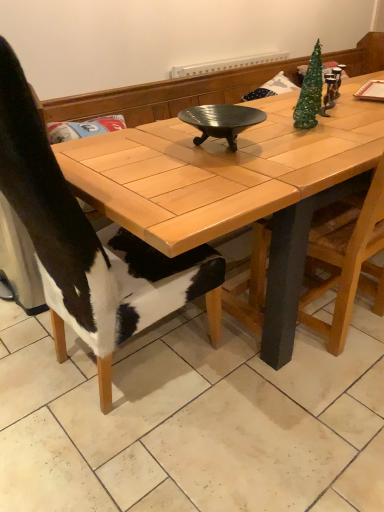
Question: From the image's perspective, does cowhide at left, which ranks as the first chair in left-to-right order, appear higher than wooden table at center?

Choices:
 (A) yes
 (B) no

Answer: (B)

Question: Is cowhide at left, marked as the 2th chair in a right-to-left arrangement, aimed at wooden table at center?

Choices:
 (A) no
 (B) yes

Answer: (B)

Question: Does cowhide at left, which ranks as the first chair in left-to-right order, have a greater height compared to wooden table at center?

Choices:
 (A) yes
 (B) no

Answer: (A)

Question: From a real-world perspective, does cowhide at left, which ranks as the first chair in left-to-right order, stand above wooden table at center?

Choices:
 (A) yes
 (B) no

Answer: (A)

Question: Is wooden table at center at the back of cowhide at left, marked as the 2th chair in a right-to-left arrangement?

Choices:
 (A) no
 (B) yes

Answer: (B)

Question: Can you confirm if cowhide at left, marked as the 2th chair in a right-to-left arrangement, is smaller than wooden table at center?

Choices:
 (A) no
 (B) yes

Answer: (B)

Question: Would you consider black ribbed metal wok at center to be distant from cowhide at left, marked as the 2th chair in a right-to-left arrangement?

Choices:
 (A) no
 (B) yes

Answer: (A)

Question: Is black ribbed metal wok at center thinner than cowhide at left, which ranks as the first chair in left-to-right order?

Choices:
 (A) yes
 (B) no

Answer: (A)

Question: Does black ribbed metal wok at center come behind cowhide at left, which ranks as the first chair in left-to-right order?

Choices:
 (A) no
 (B) yes

Answer: (B)

Question: From a real-world perspective, is black ribbed metal wok at center physically below cowhide at left, marked as the 2th chair in a right-to-left arrangement?

Choices:
 (A) no
 (B) yes

Answer: (A)

Question: Considering the relative sizes of black ribbed metal wok at center and cowhide at left, marked as the 2th chair in a right-to-left arrangement, in the image provided, is black ribbed metal wok at center smaller than cowhide at left, marked as the 2th chair in a right-to-left arrangement,?

Choices:
 (A) yes
 (B) no

Answer: (A)

Question: Is black ribbed metal wok at center outside of cowhide at left, which ranks as the first chair in left-to-right order?

Choices:
 (A) no
 (B) yes

Answer: (B)

Question: Can you confirm if black ribbed metal wok at center is positioned to the left of wooden table at center?

Choices:
 (A) yes
 (B) no

Answer: (A)